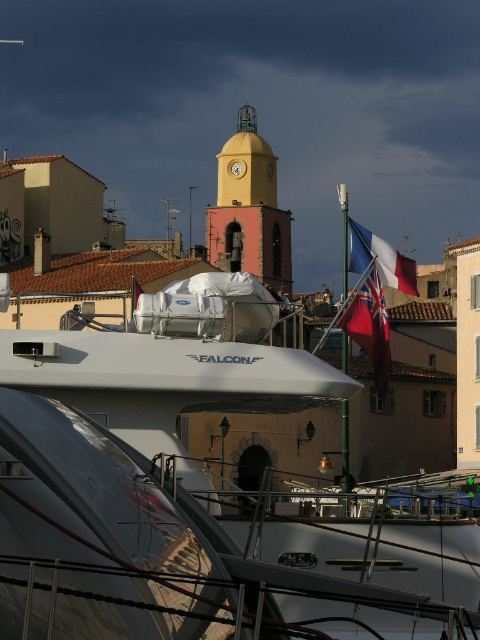
You are standing at the dock looking at the yacht named FALCON. There are two points marked on the yacht. One is at coordinate point (180,467) and the other is at coordinate point (368,240). Which point is closer to you?

Point (180,467) is closer to the viewer than point (368,240).

You are standing at the point with coordinates [199,497] in the marina scene. What object is located exactly at this point?

The white glossy boat at center is located exactly at point [199,497].